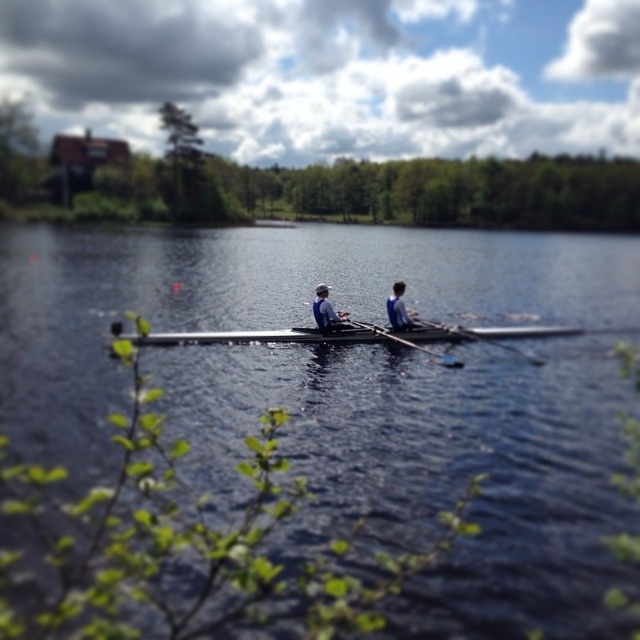
Which is more to the left, dark blue water at center or blue fabric shirt at center?

dark blue water at center is more to the left.

Does dark blue water at center have a lesser height compared to blue fabric shirt at center?

No.

What do you see at coordinates (355, 394) in the screenshot? This screenshot has width=640, height=640. I see `dark blue water at center` at bounding box center [355, 394].

The height and width of the screenshot is (640, 640). In order to click on dark blue water at center in this screenshot , I will do `click(355, 394)`.

Does dark blue water at center have a lesser width compared to matte blue shirt at center?

No.

Who is lower down, dark blue water at center or matte blue shirt at center?

Positioned lower is matte blue shirt at center.

Does point (621, 392) come behind point (330, 314)?

No, (621, 392) is in front of (330, 314).

At what (x,y) coordinates should I click in order to perform the action: click on dark blue water at center. Please return your answer as a coordinate pair (x, y). The image size is (640, 640). Looking at the image, I should click on (355, 394).

Is blue fabric shirt at center above wooden oar at center?

Yes.

Is point (401, 305) positioned in front of point (406, 340)?

Yes, point (401, 305) is in front of point (406, 340).

Identify the location of blue fabric shirt at center. Image resolution: width=640 pixels, height=640 pixels. (397, 308).